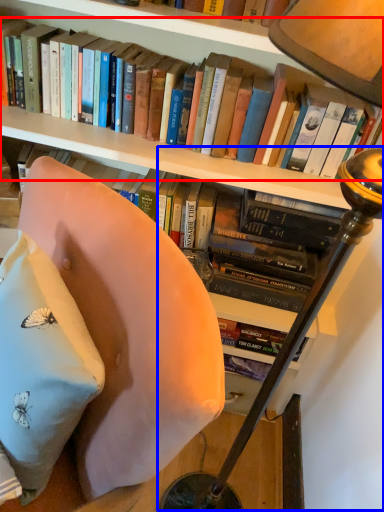
Question: Which of the following is the closest to the observer, book (highlighted by a red box) or table lamp (highlighted by a blue box)?

Choices:
 (A) book
 (B) table lamp

Answer: (B)